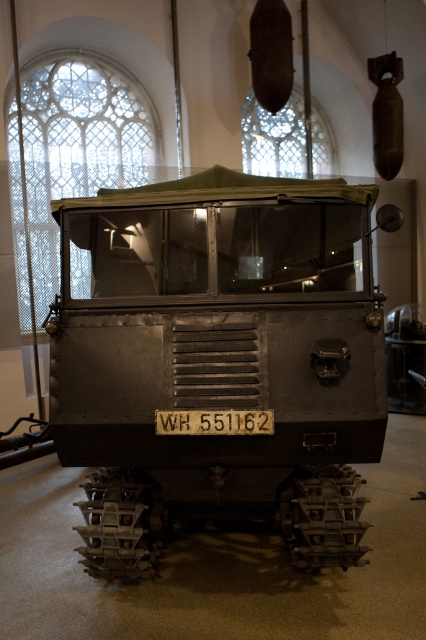
You are a museum curator planning to move the matte gray train car at center and the black metal license plate at center to a new exhibition space. The entrance to the new space has a height restriction of 3 meters. Can both items pass through the entrance without any modifications?

The matte gray train car at center is larger in size than the black metal license plate at center. However, the exact height of the matte gray train car at center is not provided in the description. Therefore, it is uncertain whether both items can pass through the 3 meter height restriction without modifications.

You are a museum guide explaining the layout of the exhibit. A visitor asks, which object is positioned higher in the scene between the matte gray train car at center and the black metal license plate at center? Please answer based on their spatial relationship.

The matte gray train car at center is located above the black metal license plate at center, so it is positioned higher in the scene.